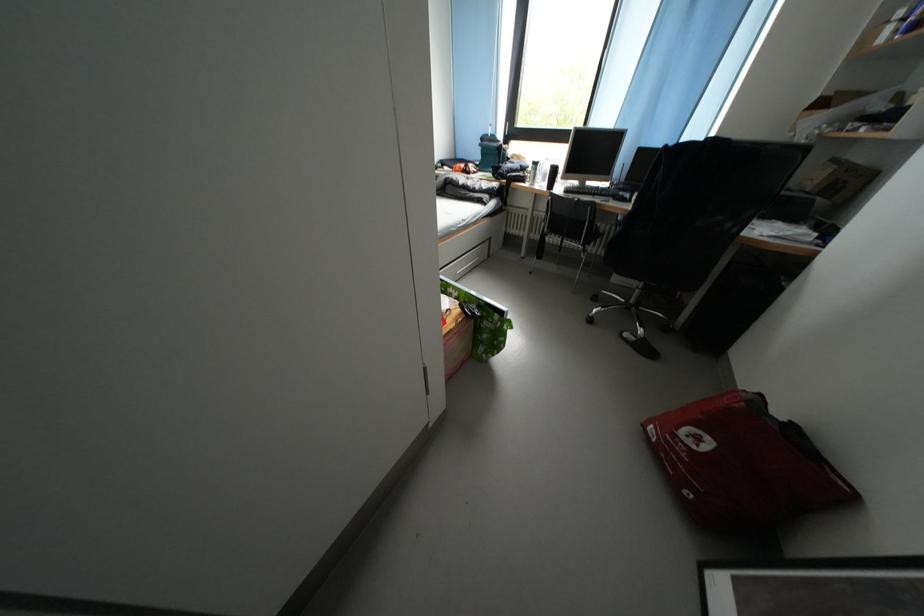
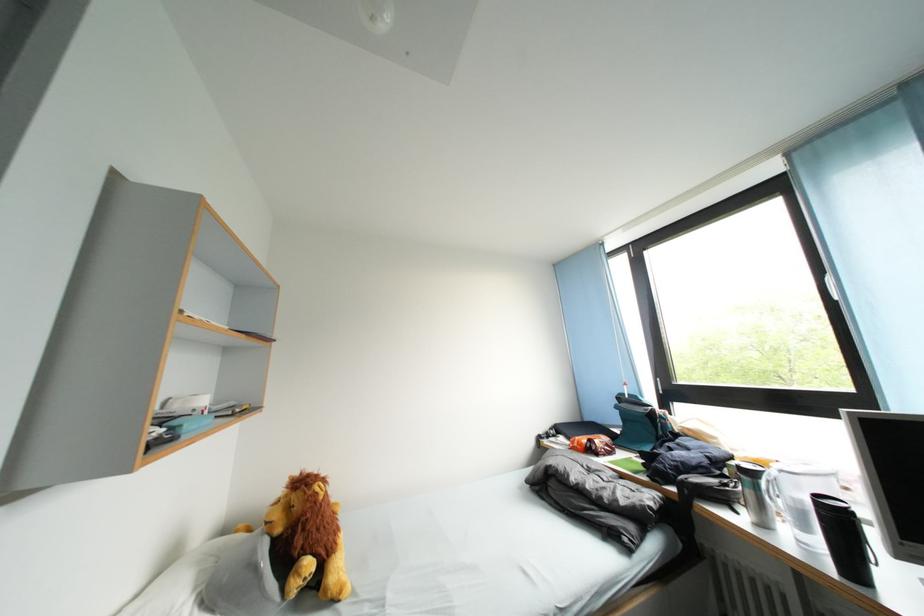
Where in the second image is the point corresponding to point (473, 177) from the first image?

(600, 455)